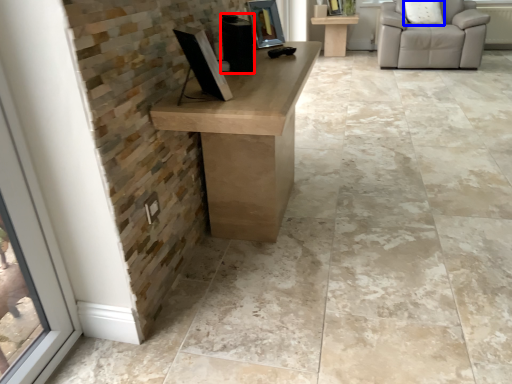
Question: Which object appears closest to the camera in this image, speaker (highlighted by a red box) or pillow (highlighted by a blue box)?

Choices:
 (A) speaker
 (B) pillow

Answer: (A)